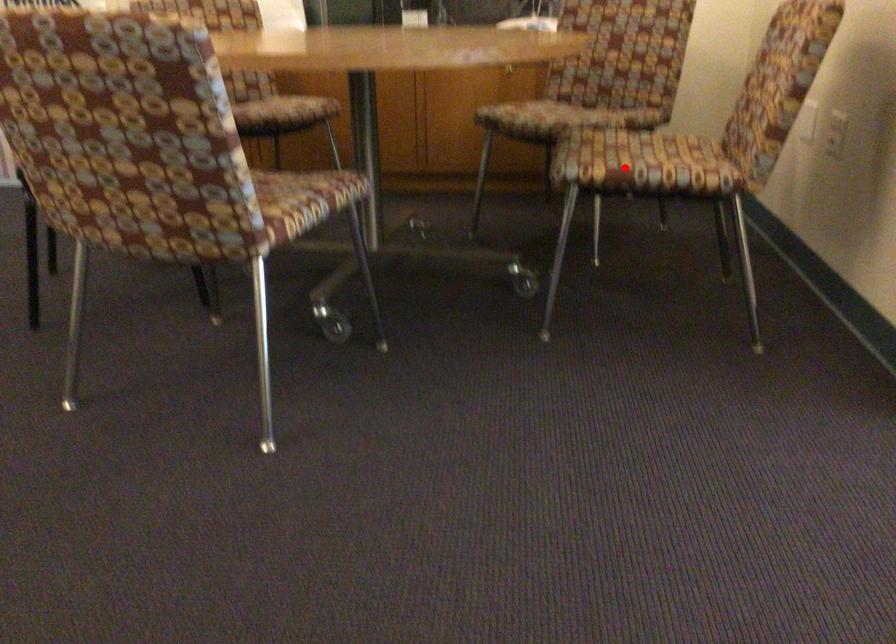
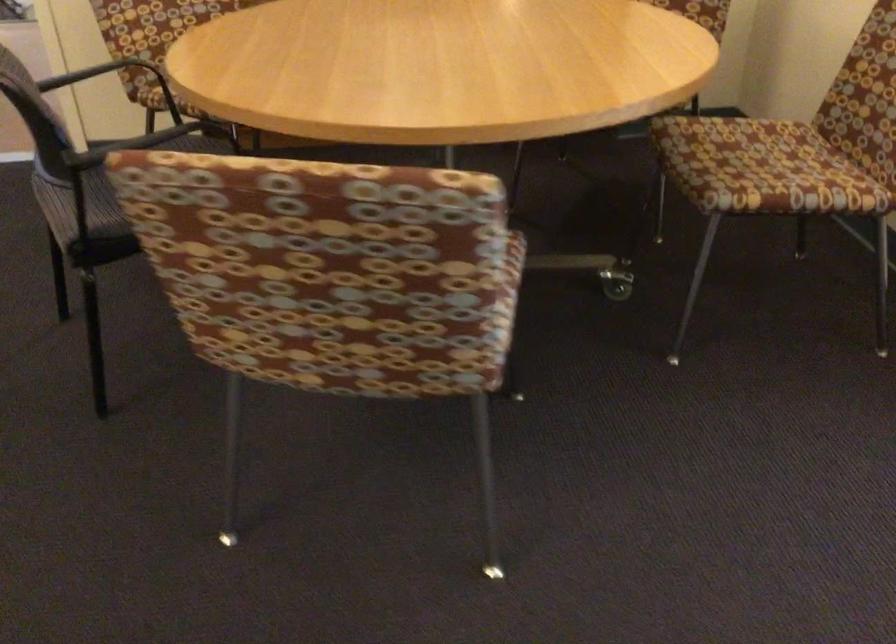
In the second image, find the point that corresponds to the highlighted location in the first image.

(778, 187)